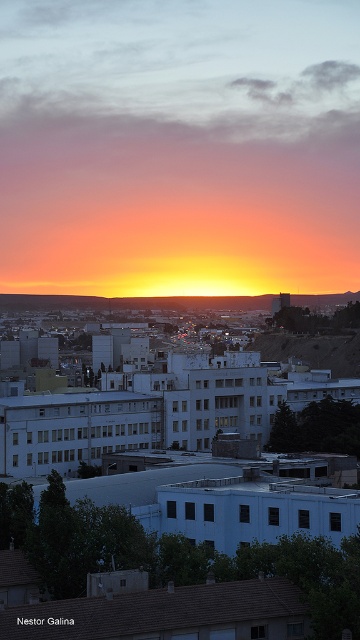
Can you confirm if matte orange sky at center is bigger than brown rocky hill at center?

Yes, matte orange sky at center is bigger than brown rocky hill at center.

Is matte orange sky at center smaller than brown rocky hill at center?

No, matte orange sky at center is not smaller than brown rocky hill at center.

Does point (109, 22) come closer to viewer compared to point (349, 323)?

No.

Where is `matte orange sky at center`? The height and width of the screenshot is (640, 360). matte orange sky at center is located at coordinates (178, 147).